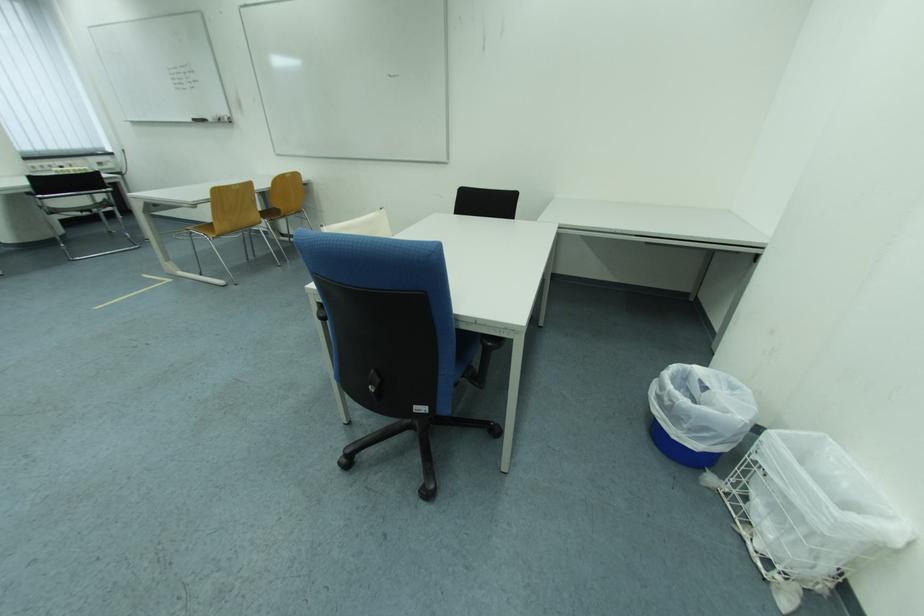
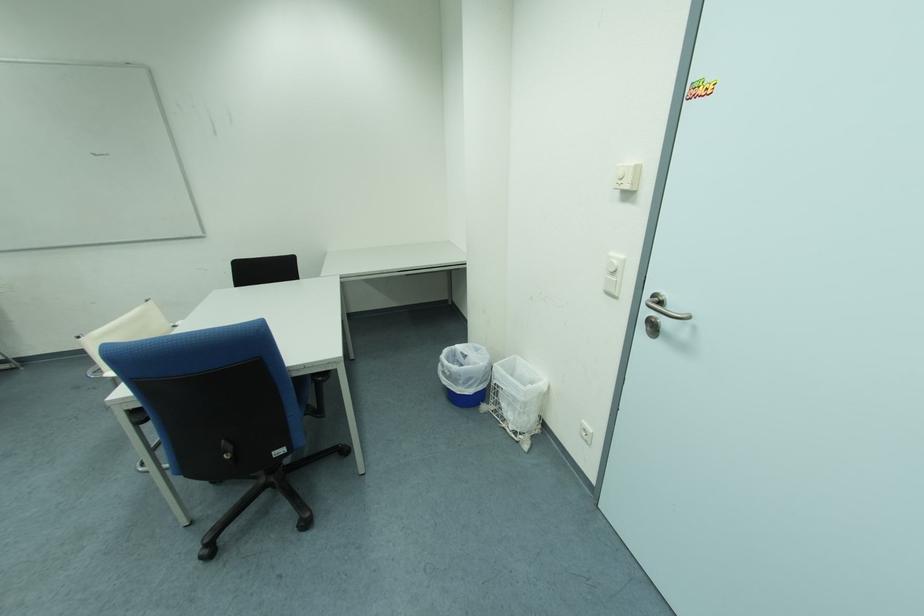
Find the pixel in the second image that matches [464,330] in the first image.

(298, 379)